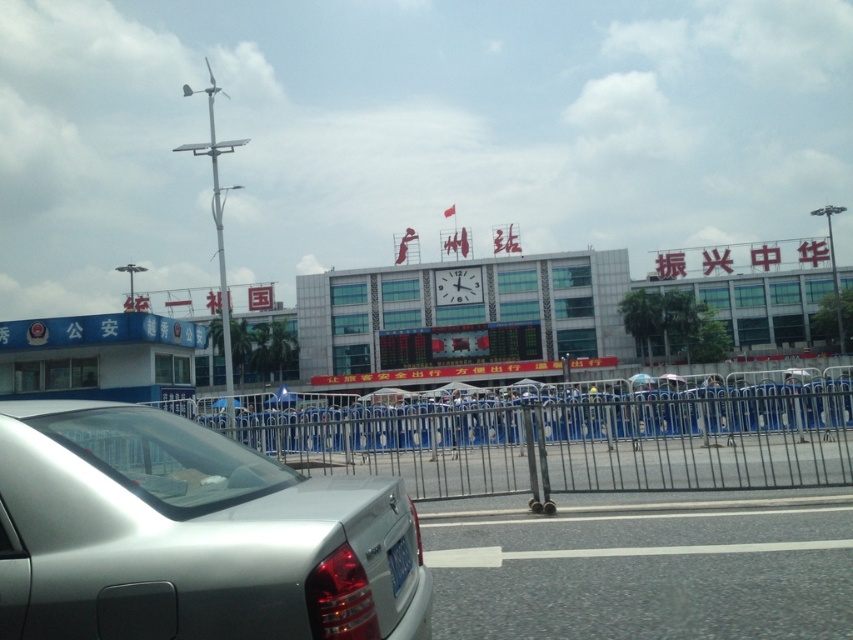
You are a photographer standing at the entrance of Guangzhou Station. You want to take a photo of the station sign and the clock. However, there is a metallic blue fence at center and a blue metallic license plate at lower center in your way. Which object is taller and might block your view more?

The metallic blue fence at center is much taller than the blue metallic license plate at lower center, so it might block your view more.

You are a delivery person who needs to move a 6.5 feet wide package from the satin silver sedan at lower left to the entrance of Guangzhou Station. Can you move the package through the gap between the sedan and the barricade?

The gap between the satin silver sedan at lower left and the barricade is 7.74 feet, which is wider than the 6.5 feet wide package. Therefore, the package can be moved through the gap.